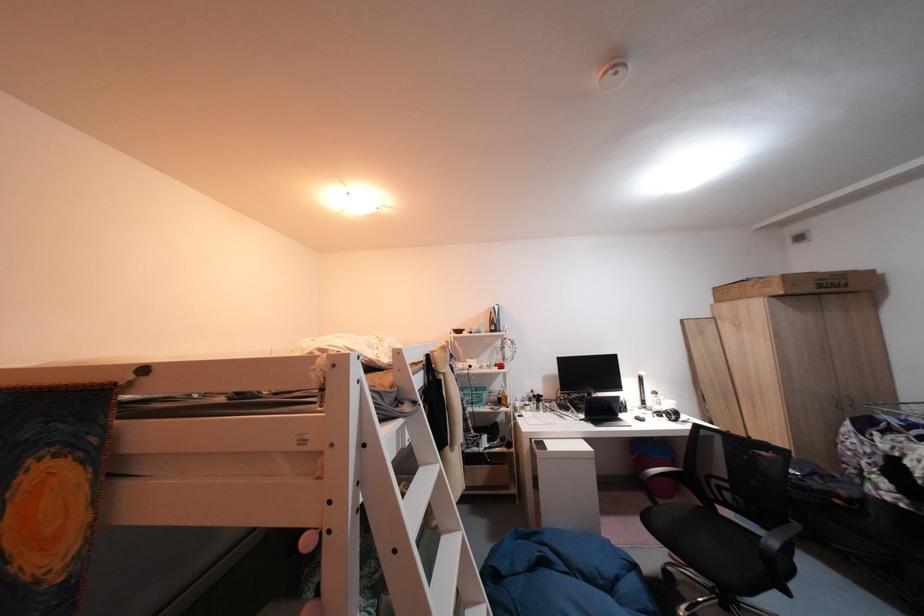
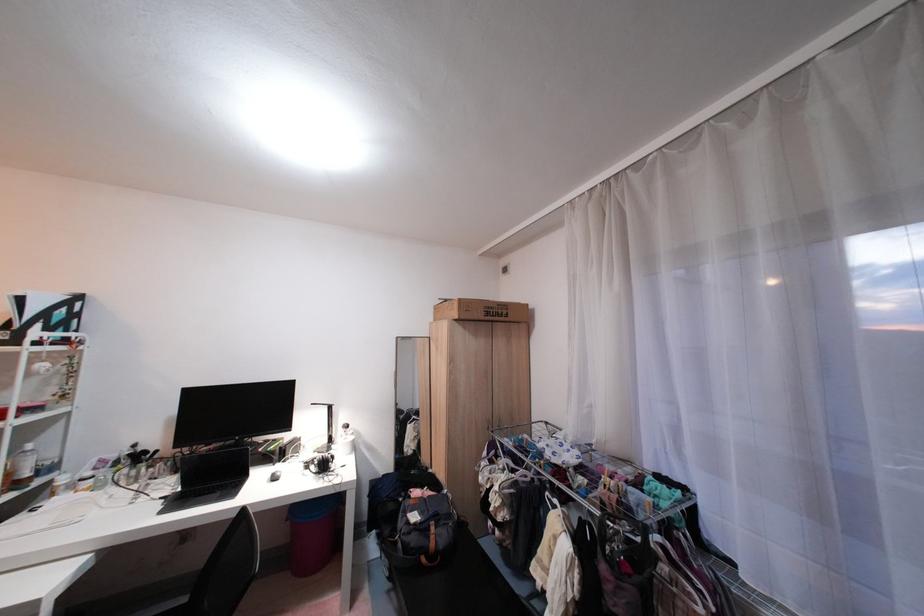
Locate, in the second image, the point that corresponds to pixel 848 503 in the first image.

(434, 561)